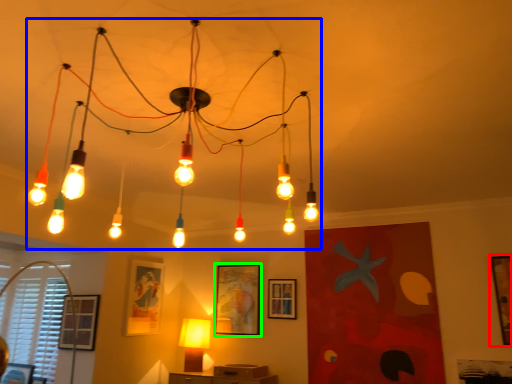
Question: Which object is the closest to the picture frame (highlighted by a red box)? Choose among these: lamp (highlighted by a blue box) or picture frame (highlighted by a green box).

Choices:
 (A) lamp
 (B) picture frame

Answer: (B)